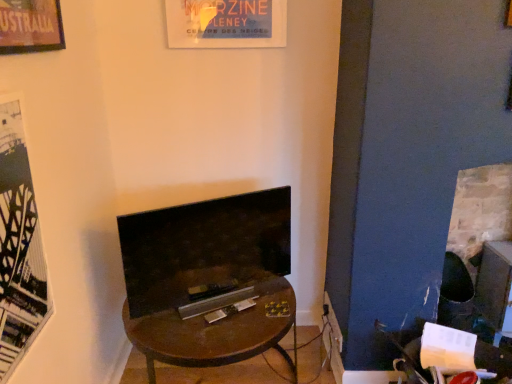
This screenshot has width=512, height=384. In order to click on free point behind metallic silver magazine at center in this screenshot , I will do `click(240, 289)`.